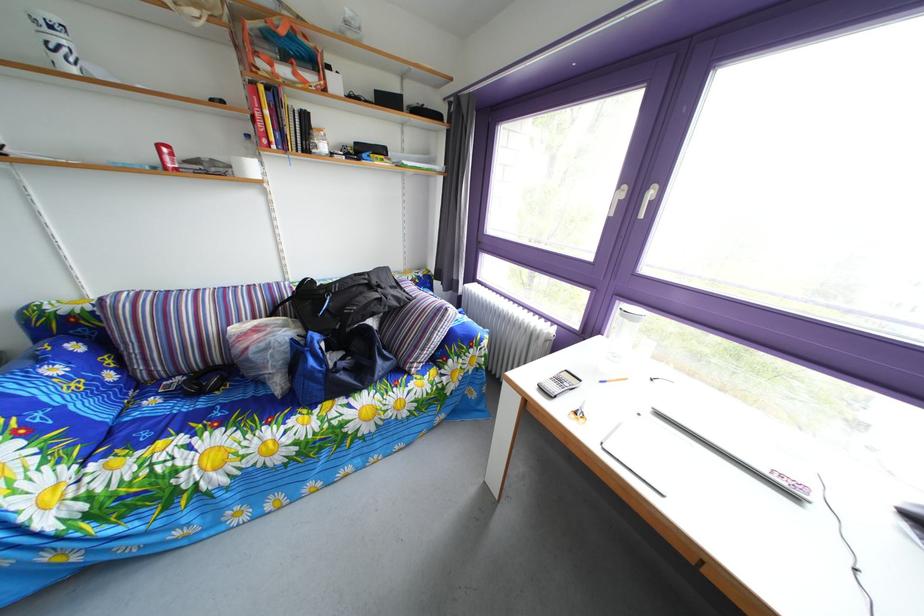
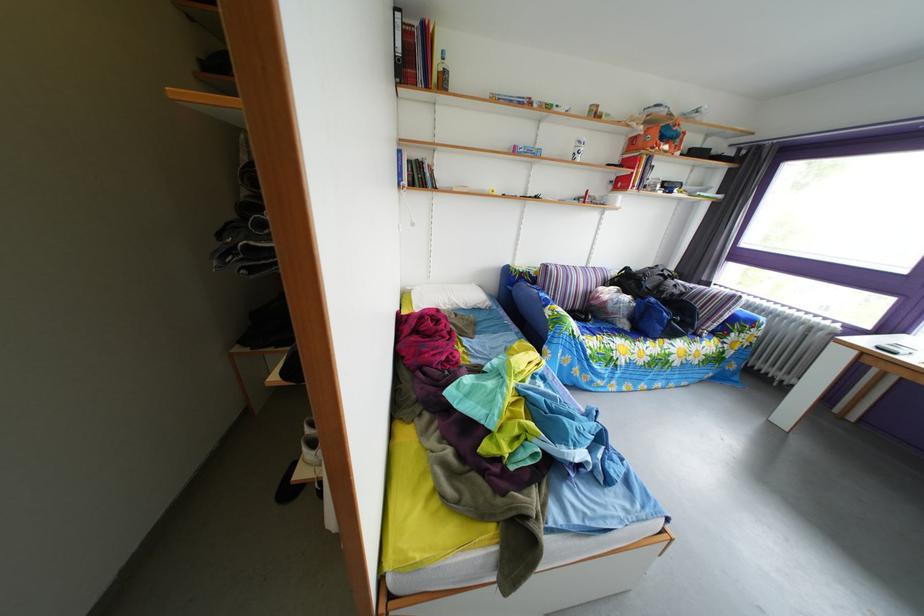
Where in the second image is the point corresponding to (x=296, y=65) from the first image?

(673, 147)